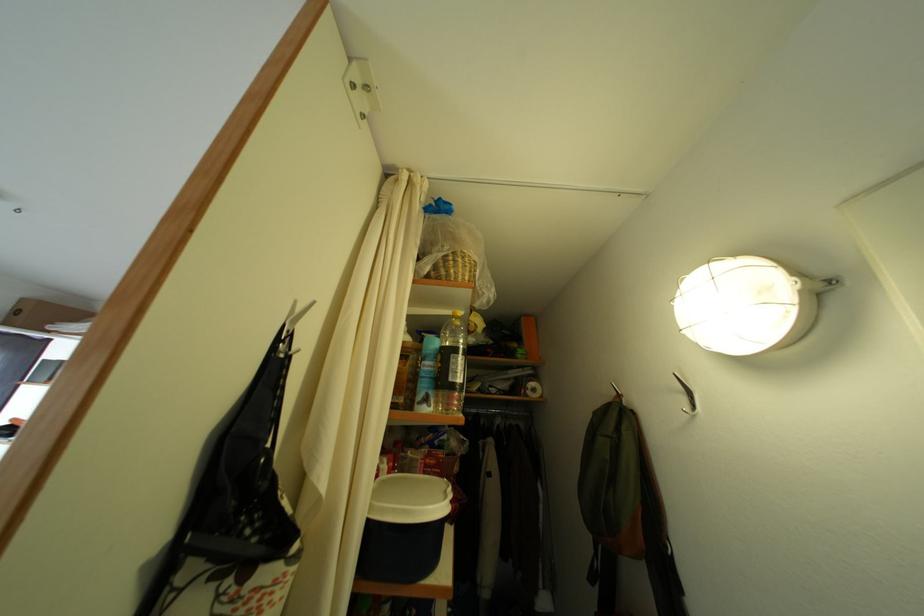
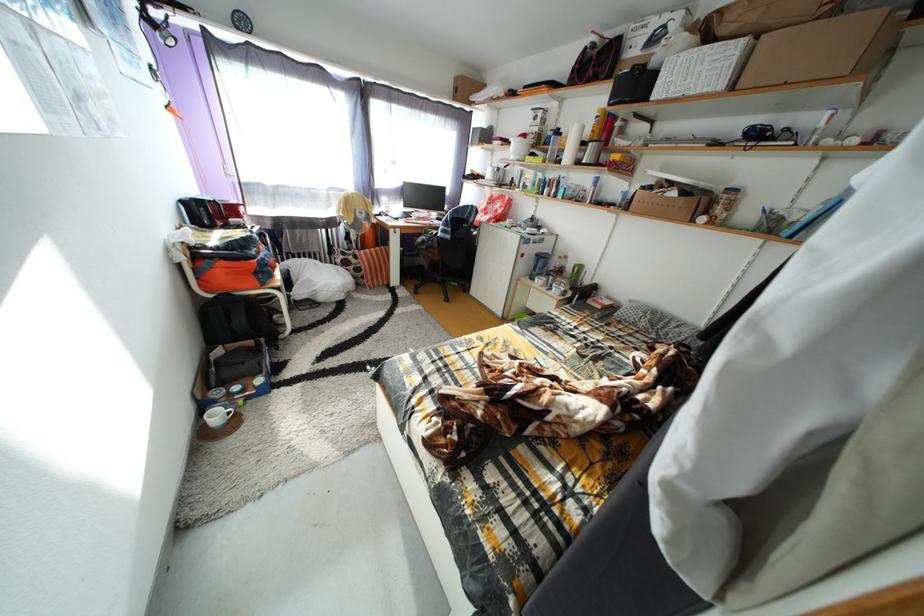
Based on the continuous images, in which direction is the camera rotating?

The rotation direction of the camera is left-down.